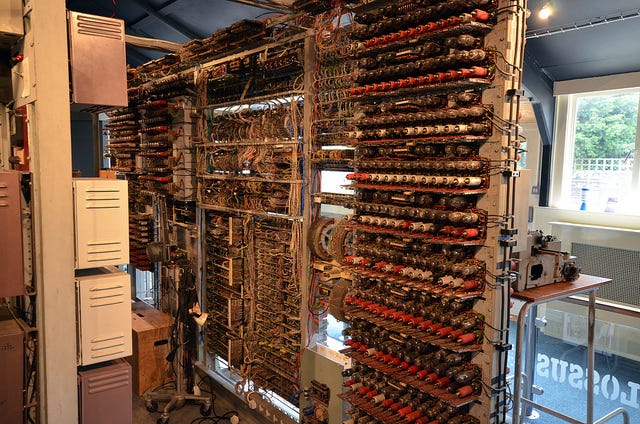
Identify the location of window. (612, 149).